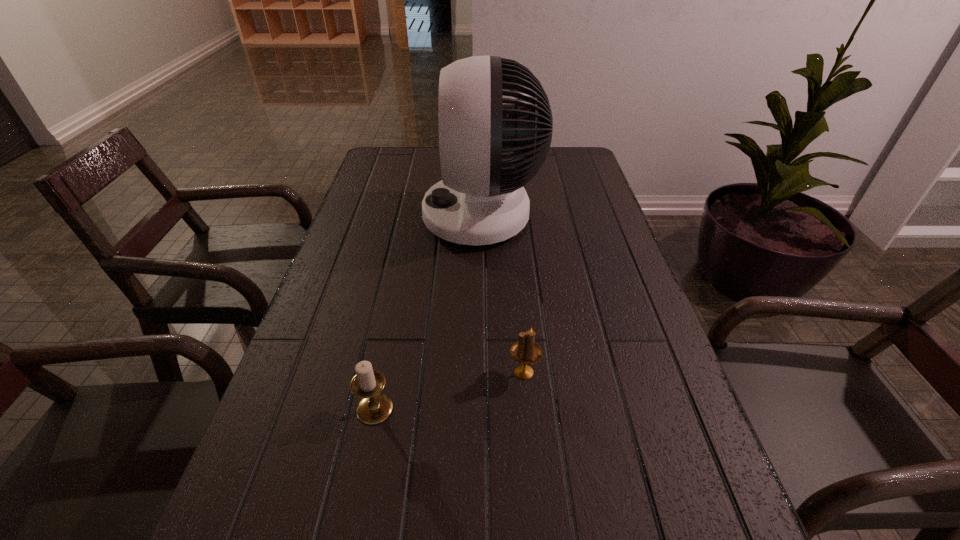
Where is `the farthest object`? This screenshot has height=540, width=960. the farthest object is located at coordinates (480, 200).

Where is `the tallest object`? the tallest object is located at coordinates (480, 200).

Where is `the second farthest object`? The width and height of the screenshot is (960, 540). the second farthest object is located at coordinates (525, 351).

You are a GUI agent. You are given a task and a screenshot of the screen. Output one action in this format:
    pyautogui.click(x=<x>, y=<y>)
    Task: Click on the right candle holder
    
    Given the screenshot: What is the action you would take?
    pyautogui.click(x=525, y=351)

Image resolution: width=960 pixels, height=540 pixels. In order to click on the nearest object in this screenshot , I will do `click(374, 407)`.

I want to click on the nearer candle holder, so click(x=374, y=407).

Where is `vacant area situated 0.060m on the grille of the fan`? The height and width of the screenshot is (540, 960). vacant area situated 0.060m on the grille of the fan is located at coordinates (401, 217).

The height and width of the screenshot is (540, 960). Identify the location of free point located on the grille of the fan. (375, 217).

Find the location of a particular element. This screenshot has height=540, width=960. vacant area situated on the grille of the fan is located at coordinates (379, 217).

The image size is (960, 540). Identify the location of free space located 0.150m on the back of the second farthest object. (517, 306).